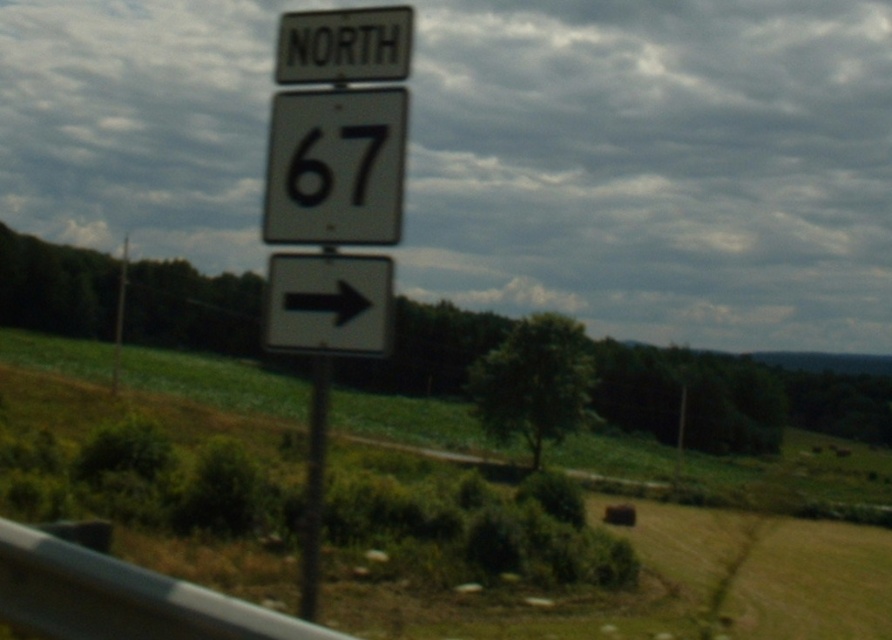
Which is below, white glossy sign at center or black matte number at center?

black matte number at center is below.

Is white glossy sign at center closer to the viewer compared to black matte number at center?

Yes, white glossy sign at center is in front of black matte number at center.

Image resolution: width=892 pixels, height=640 pixels. I want to click on white glossy sign at center, so click(x=335, y=166).

Does white glossy sign at center appear under metallic pole at center?

No, white glossy sign at center is not below metallic pole at center.

Can you confirm if white glossy sign at center is shorter than metallic pole at center?

Indeed, white glossy sign at center has a lesser height compared to metallic pole at center.

At what (x,y) coordinates should I click in order to perform the action: click on white glossy sign at center. Please return your answer as a coordinate pair (x, y). The width and height of the screenshot is (892, 640). Looking at the image, I should click on (335, 166).

Locate an element on the screen. The width and height of the screenshot is (892, 640). white glossy sign at center is located at coordinates (335, 166).

The image size is (892, 640). I want to click on metallic pole at center, so click(x=312, y=488).

Is point (314, 513) positioned after point (378, 125)?

That is False.

The width and height of the screenshot is (892, 640). What are the coordinates of `metallic pole at center` in the screenshot? It's located at (312, 488).